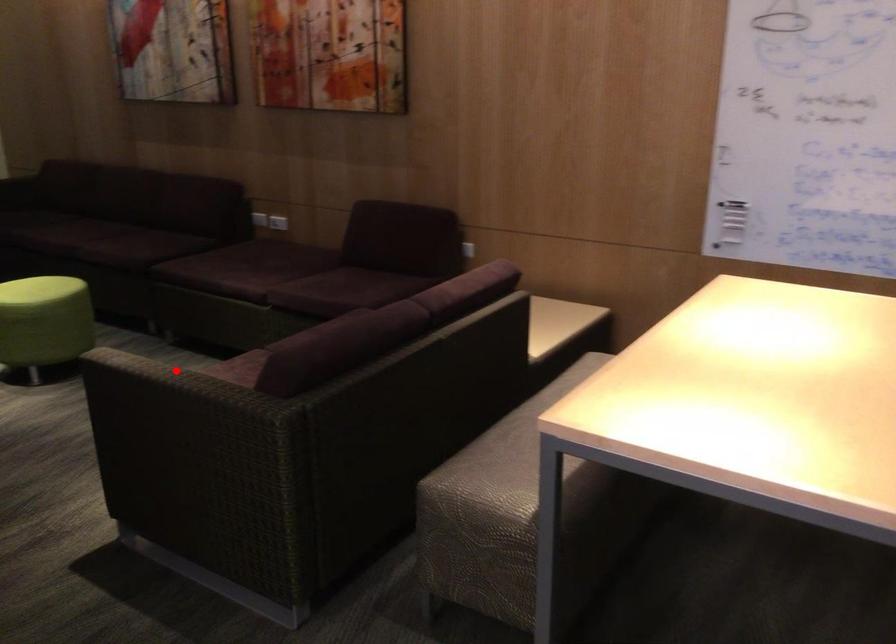
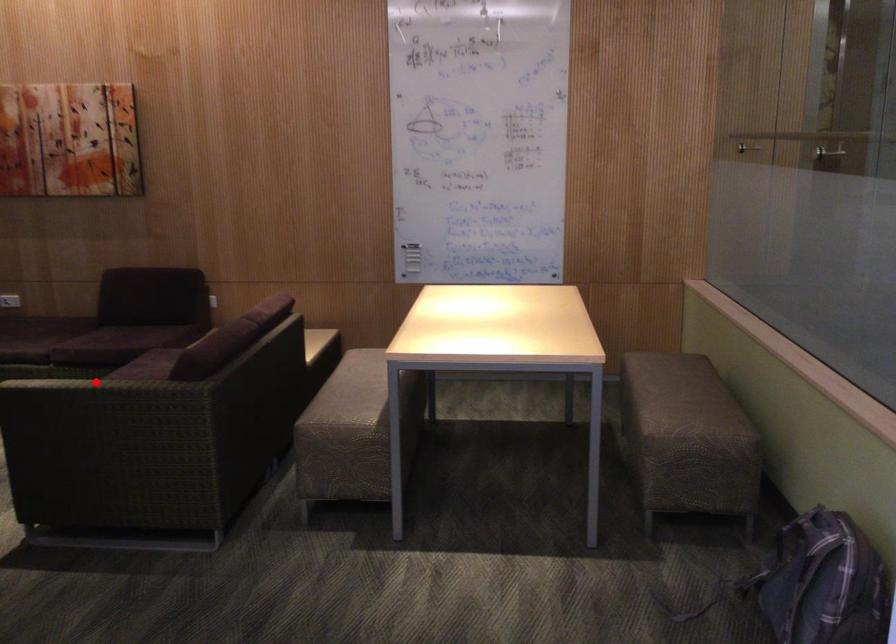
I am providing you with two images of the same scene from different viewpoints. A red point is marked on the first image and another point is marked on the second image. Is the marked point in image1 the same physical position as the marked point in image2?

Yes